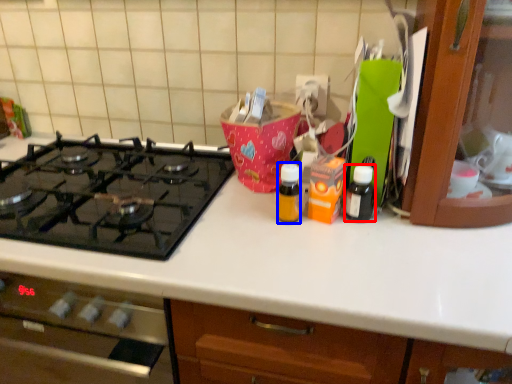
Question: Among these objects, which one is farthest to the camera, bottle (highlighted by a red box) or bottle (highlighted by a blue box)?

Choices:
 (A) bottle
 (B) bottle

Answer: (A)